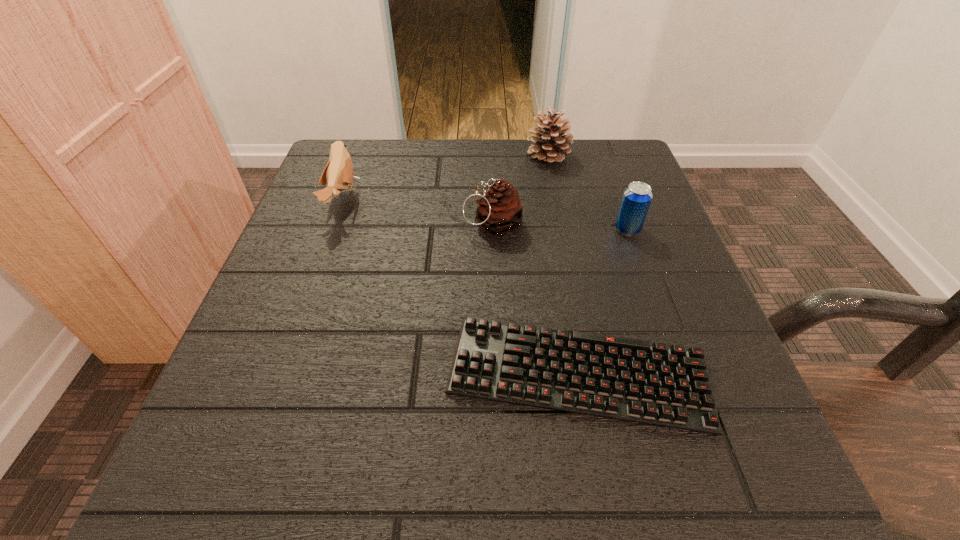
This screenshot has width=960, height=540. Identify the location of object that is the closest to the farthest object. (500, 210).

At what (x,y) coordinates should I click in order to perform the action: click on object identified as the fourth closest to the leftmost object. Please return your answer as a coordinate pair (x, y). This screenshot has height=540, width=960. Looking at the image, I should click on (636, 199).

Where is `vacant space that satisfies the following two spatial constraints: 1. on the back side of the computer keyboard; 2. on the right side of the right pinecone`? vacant space that satisfies the following two spatial constraints: 1. on the back side of the computer keyboard; 2. on the right side of the right pinecone is located at coordinates (540, 156).

This screenshot has height=540, width=960. Find the location of `vacant area that satisfies the following two spatial constraints: 1. at the beak of the bird; 2. on the right side of the computer keyboard`. vacant area that satisfies the following two spatial constraints: 1. at the beak of the bird; 2. on the right side of the computer keyboard is located at coordinates (280, 374).

Where is `vacant space that satisfies the following two spatial constraints: 1. at the beak of the leftmost object; 2. on the back side of the shortest object`? The image size is (960, 540). vacant space that satisfies the following two spatial constraints: 1. at the beak of the leftmost object; 2. on the back side of the shortest object is located at coordinates (280, 374).

What are the coordinates of `vacant area that satisfies the following two spatial constraints: 1. with a leaf charm attached to the left pinecone; 2. on the left side of the shortest object` in the screenshot? It's located at (497, 374).

I want to click on vacant area in the image that satisfies the following two spatial constraints: 1. with a leaf charm attached to the nearer pinecone; 2. on the back side of the computer keyboard, so click(x=497, y=374).

At what (x,y) coordinates should I click in order to perform the action: click on free space that satisfies the following two spatial constraints: 1. on the back side of the farthest object; 2. on the right side of the computer keyboard. Please return your answer as a coordinate pair (x, y). Looking at the image, I should click on (540, 156).

This screenshot has height=540, width=960. In order to click on vacant space that satisfies the following two spatial constraints: 1. at the beak of the bird; 2. on the left side of the beer can in this screenshot , I will do `click(332, 230)`.